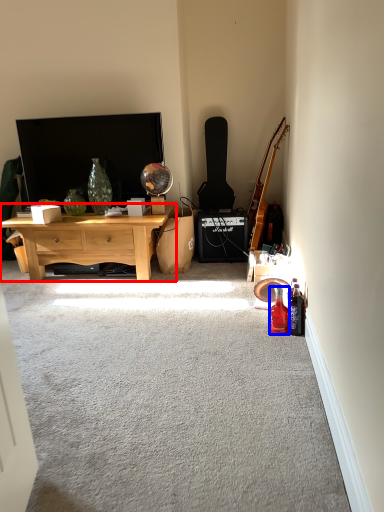
Question: Which object is further to the camera taking this photo, desk (highlighted by a red box) or bottle (highlighted by a blue box)?

Choices:
 (A) desk
 (B) bottle

Answer: (A)